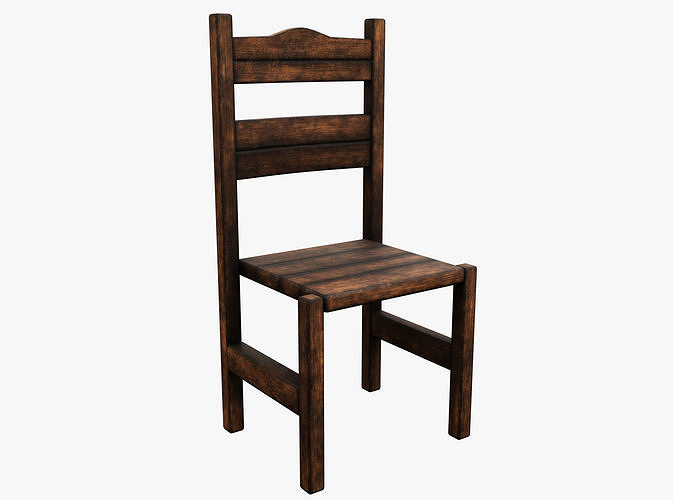
You are a GUI agent. You are given a task and a screenshot of the screen. Output one action in this format:
    pyautogui.click(x=<x>, y=<y>)
    Task: Click on the seat
    
    Given the screenshot: What is the action you would take?
    click(x=367, y=277)